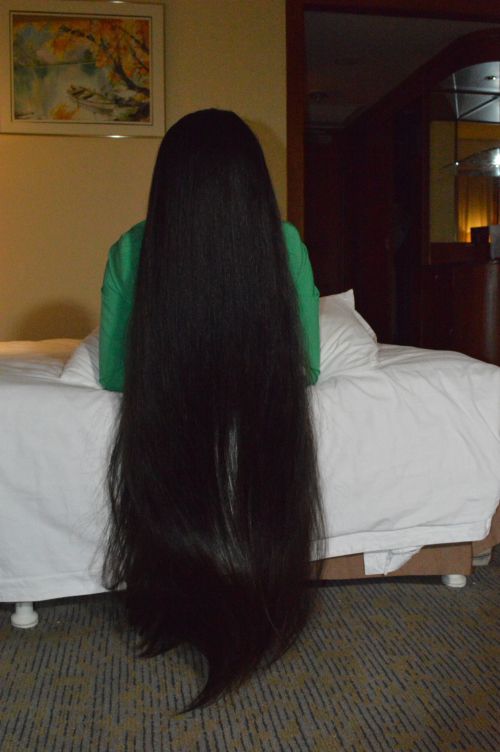
The width and height of the screenshot is (500, 752). I want to click on picture, so click(94, 117).